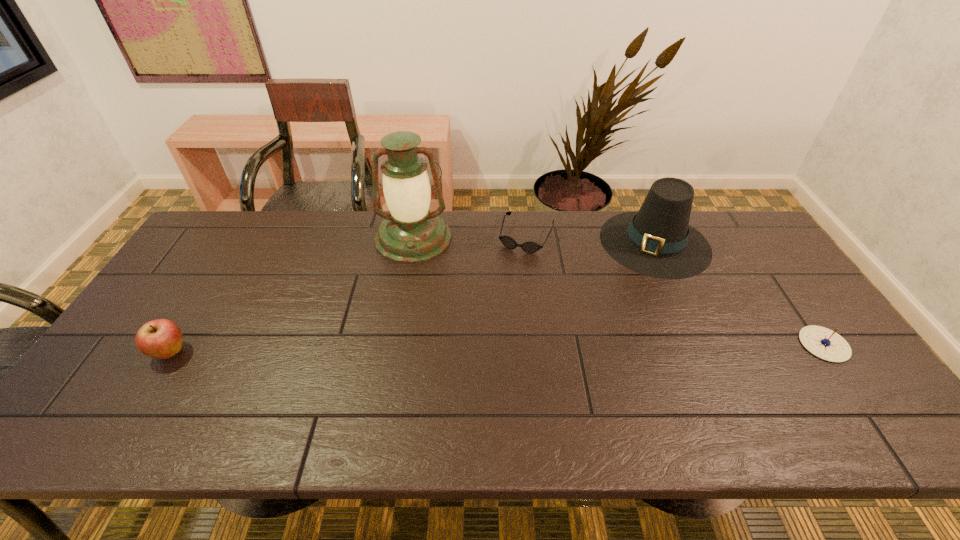
Locate an element on the screen. The width and height of the screenshot is (960, 540). the leftmost object is located at coordinates (162, 338).

You are a GUI agent. You are given a task and a screenshot of the screen. Output one action in this format:
    pyautogui.click(x=<x>, y=<y>)
    Task: Click on the third tallest object
    The height and width of the screenshot is (540, 960).
    Given the screenshot: What is the action you would take?
    pyautogui.click(x=162, y=338)

Locate an element on the screen. The image size is (960, 540). the rightmost object is located at coordinates (822, 342).

I want to click on the second shortest object, so click(822, 342).

The width and height of the screenshot is (960, 540). I want to click on the fourth object from right to left, so click(x=411, y=233).

Identify the location of the tallest object. (411, 233).

I want to click on the third object from right to left, so click(530, 246).

Identify the location of the shortest object. The image size is (960, 540). (530, 246).

What are the coordinates of `the second tallest object` in the screenshot? It's located at (657, 241).

At what (x,y) coordinates should I click in order to perform the action: click on the fourth object from left to right. Please return your answer as a coordinate pair (x, y). This screenshot has width=960, height=540. Looking at the image, I should click on (657, 241).